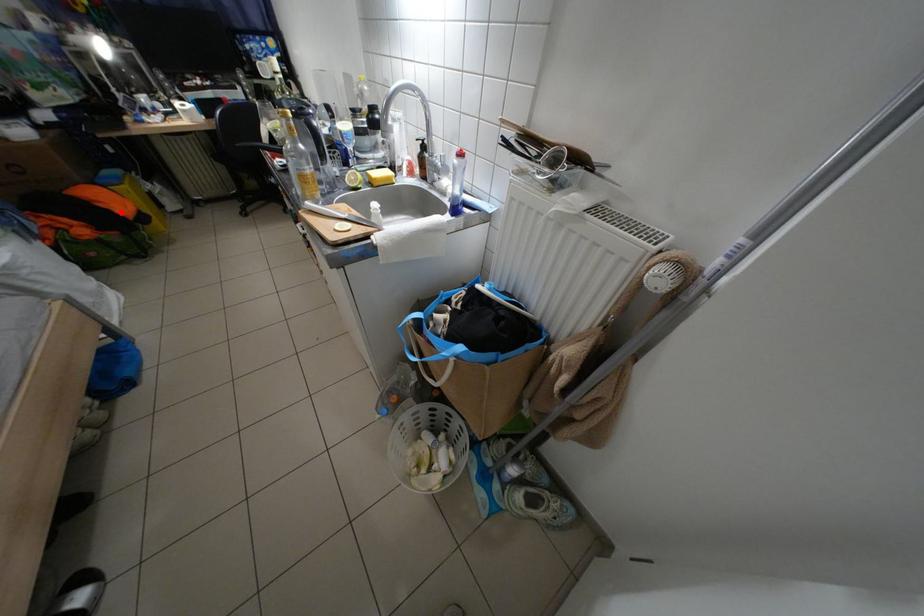
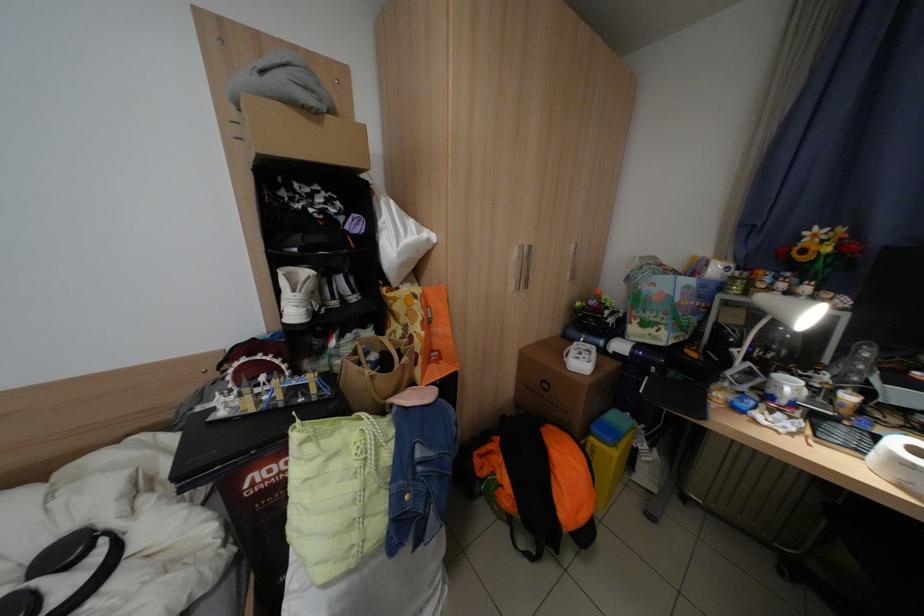
The point at the highlighted location is marked in the first image. Where is the corresponding point in the second image?

(565, 508)